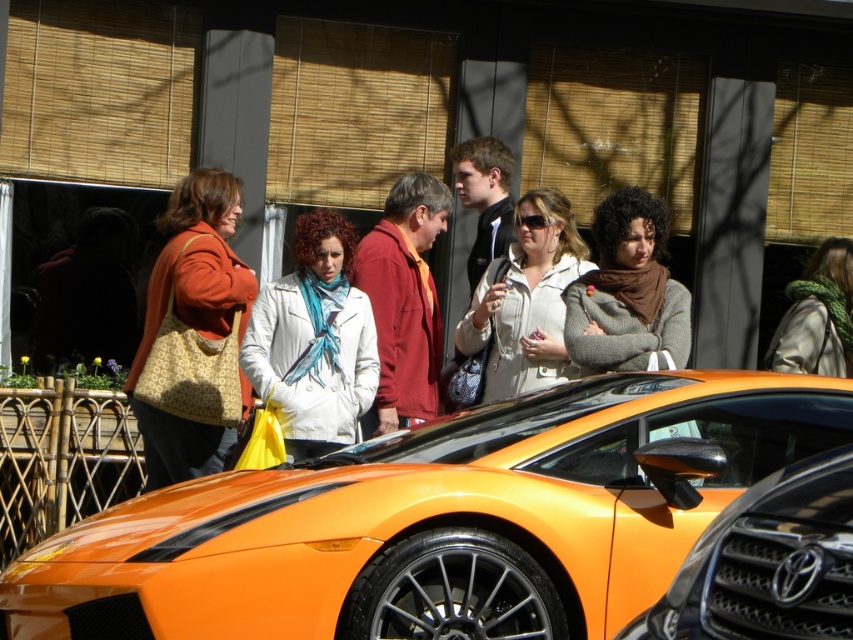
Consider the image. Who is more distant from viewer, (196, 285) or (500, 216)?

The point (500, 216) is more distant.

Between matte orange coat at left and matte black jacket at center, which one appears on the left side from the viewer's perspective?

matte orange coat at left is more to the left.

Is point (143, 362) more distant than point (473, 179)?

No, (143, 362) is in front of (473, 179).

Find the location of a particular element. This screenshot has width=853, height=640. matte orange coat at left is located at coordinates (193, 333).

Can you confirm if orange matte sports car at center is taller than white textured coat at center?

In fact, orange matte sports car at center may be shorter than white textured coat at center.

You are a GUI agent. You are given a task and a screenshot of the screen. Output one action in this format:
    pyautogui.click(x=<x>, y=<y>)
    Task: Click on the orange matte sports car at center
    Image resolution: width=853 pixels, height=640 pixels.
    Given the screenshot: What is the action you would take?
    coord(767,563)

The width and height of the screenshot is (853, 640). I want to click on orange matte sports car at center, so click(767, 563).

Who is positioned more to the left, matte red jacket at center or green knitted scarf at upper right?

matte red jacket at center is more to the left.

Who is positioned more to the right, matte red jacket at center or green knitted scarf at upper right?

Positioned to the right is green knitted scarf at upper right.

The width and height of the screenshot is (853, 640). I want to click on matte red jacket at center, so click(x=404, y=301).